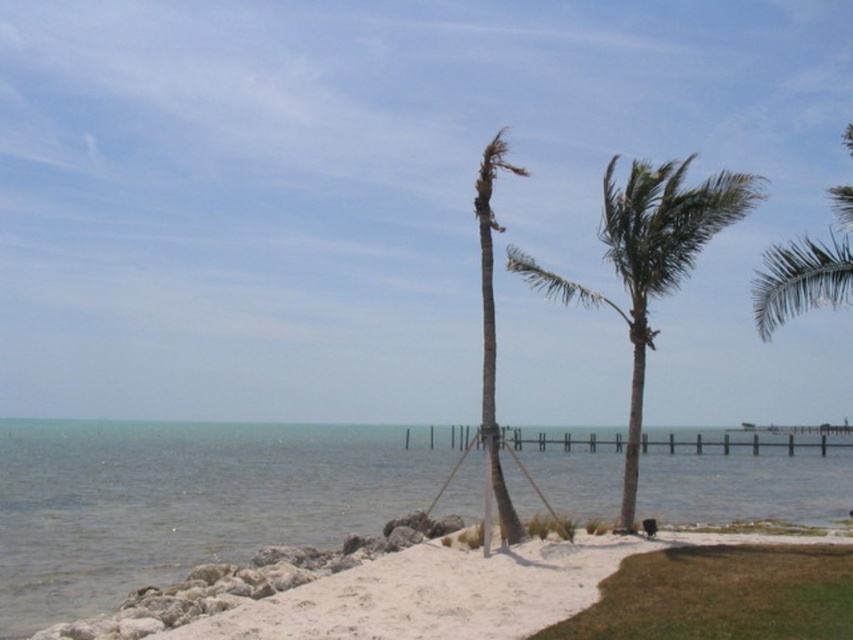
Image resolution: width=853 pixels, height=640 pixels. What do you see at coordinates (647, 260) in the screenshot?
I see `green leafy palm tree at center` at bounding box center [647, 260].

Does green leafy palm tree at center have a greater height compared to green leafy palm tree at upper right?

No.

The image size is (853, 640). Find the location of `green leafy palm tree at center`. green leafy palm tree at center is located at coordinates (647, 260).

Is clear water at lower left bigger than green textured palm tree at center?

Yes.

This screenshot has height=640, width=853. I want to click on clear water at lower left, so click(183, 500).

Find the location of `clear water at lower left`. clear water at lower left is located at coordinates (183, 500).

The width and height of the screenshot is (853, 640). What do you see at coordinates (183, 500) in the screenshot?
I see `clear water at lower left` at bounding box center [183, 500].

Is point (796, 460) positioned after point (780, 248)?

Yes, point (796, 460) is farther from viewer.

Identify the location of clear water at lower left. This screenshot has height=640, width=853. (183, 500).